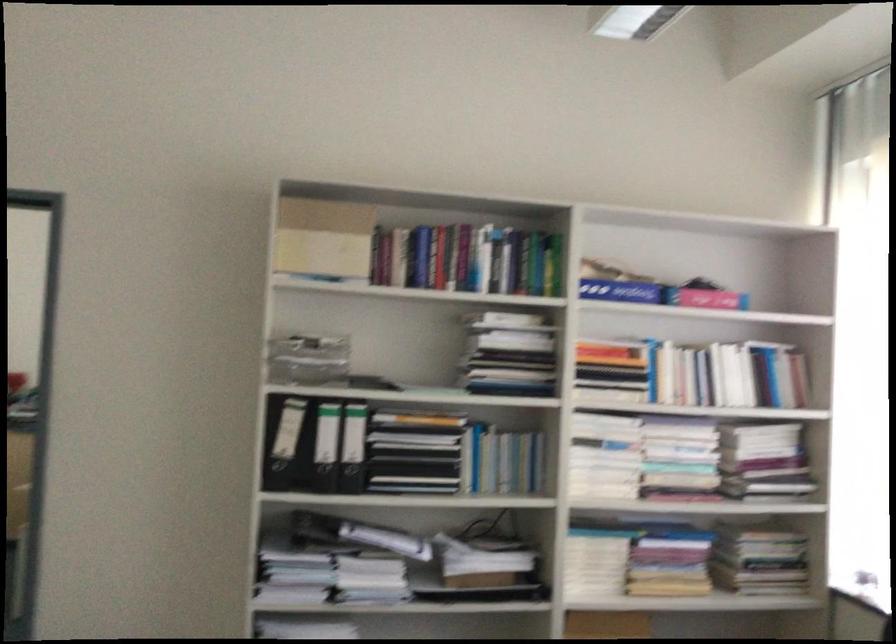
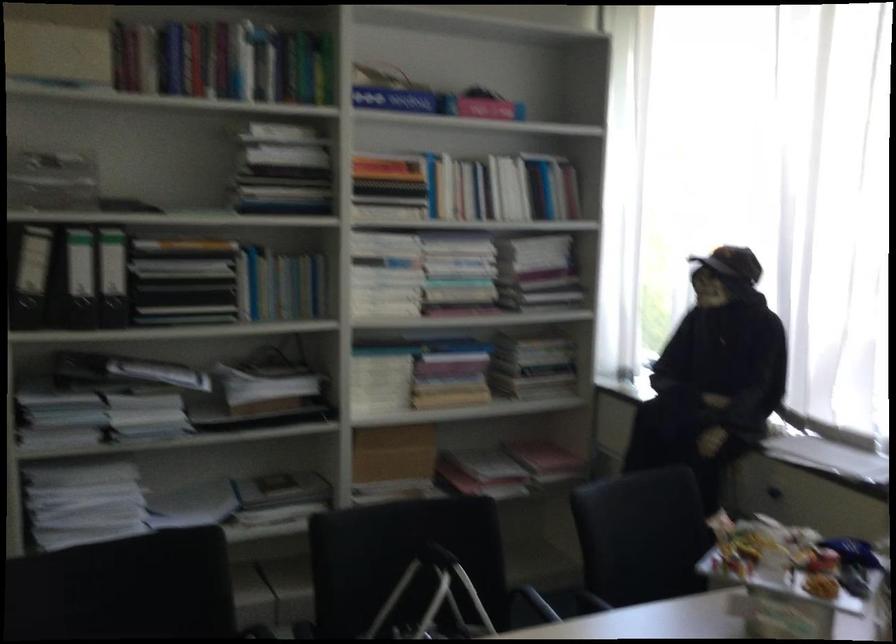
Find the pixel in the second image that matches pixel 682 460 in the first image.

(459, 272)